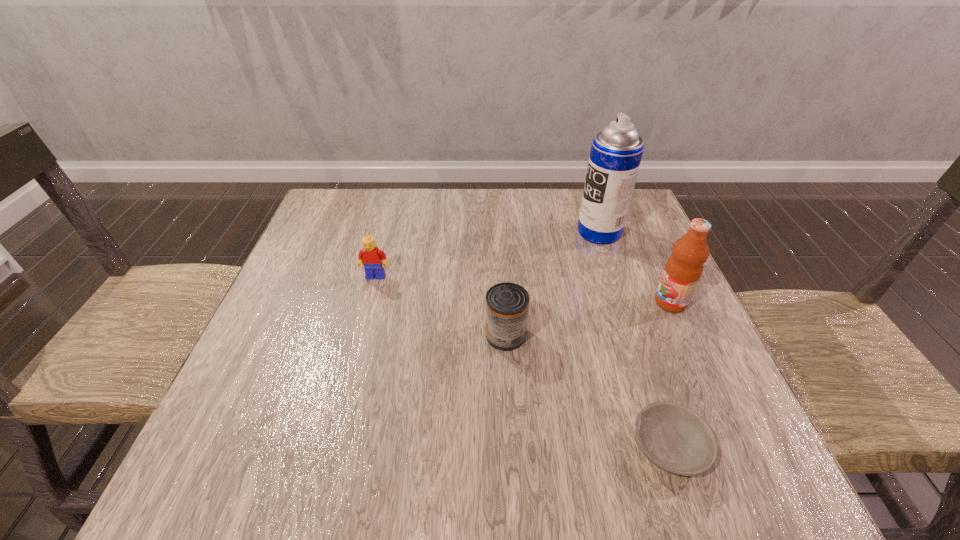
You are a GUI agent. You are given a task and a screenshot of the screen. Output one action in this format:
    pyautogui.click(x=<x>, y=<y>)
    Task: Click on the vacant space located on the label side of the aerosol can
    
    Given the screenshot: What is the action you would take?
    pyautogui.click(x=497, y=232)

What are the coordinates of `free space located 0.270m on the label side of the aerosol can` in the screenshot? It's located at (475, 232).

Locate an element on the screen. vacant position located 0.080m on the label side of the aerosol can is located at coordinates (547, 232).

Identify the location of free spot located 0.070m on the front label of the rightmost object. (623, 302).

Where is `free location located 0.400m on the front label of the rightmost object`? The image size is (960, 540). free location located 0.400m on the front label of the rightmost object is located at coordinates (472, 302).

The image size is (960, 540). I want to click on vacant position located 0.150m on the front label of the rightmost object, so click(587, 302).

Image resolution: width=960 pixels, height=540 pixels. Identify the location of vacant space situated 0.240m on the face of the leftmost object. (352, 364).

You are a GUI agent. You are given a task and a screenshot of the screen. Output one action in this format:
    pyautogui.click(x=<x>, y=<y>)
    Task: Click on the vacant point located 0.180m on the back of the second object from left to right
    The height and width of the screenshot is (540, 960).
    Given the screenshot: What is the action you would take?
    pyautogui.click(x=502, y=265)

At what (x,y) coordinates should I click in order to perform the action: click on vacant space located on the left of the nearest object. Please return your answer as a coordinate pair (x, y). The height and width of the screenshot is (540, 960). Looking at the image, I should click on (534, 447).

Identify the location of object located at the far edge. (616, 152).